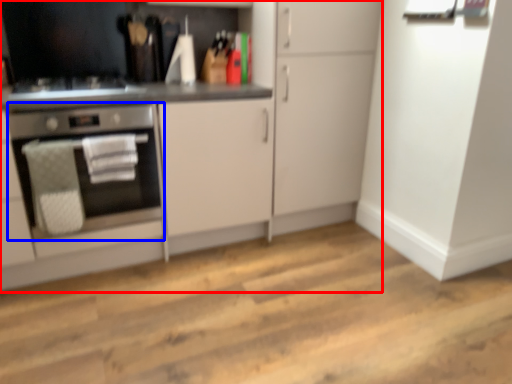
Question: Among these objects, which one is nearest to the camera, cabinetry (highlighted by a red box) or home appliance (highlighted by a blue box)?

Choices:
 (A) cabinetry
 (B) home appliance

Answer: (A)